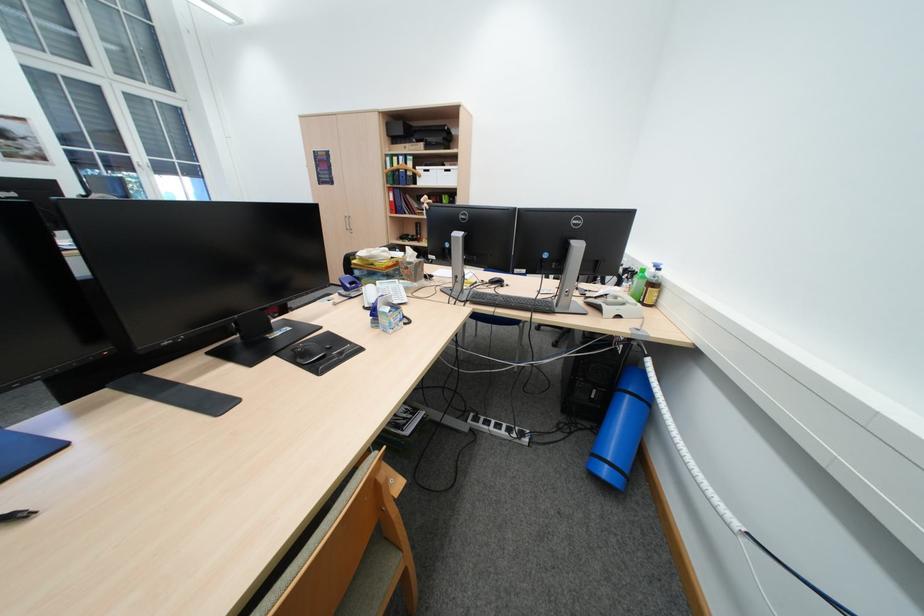
Which object does [638,285] point to?

It corresponds to the green plastic bottle in the image.